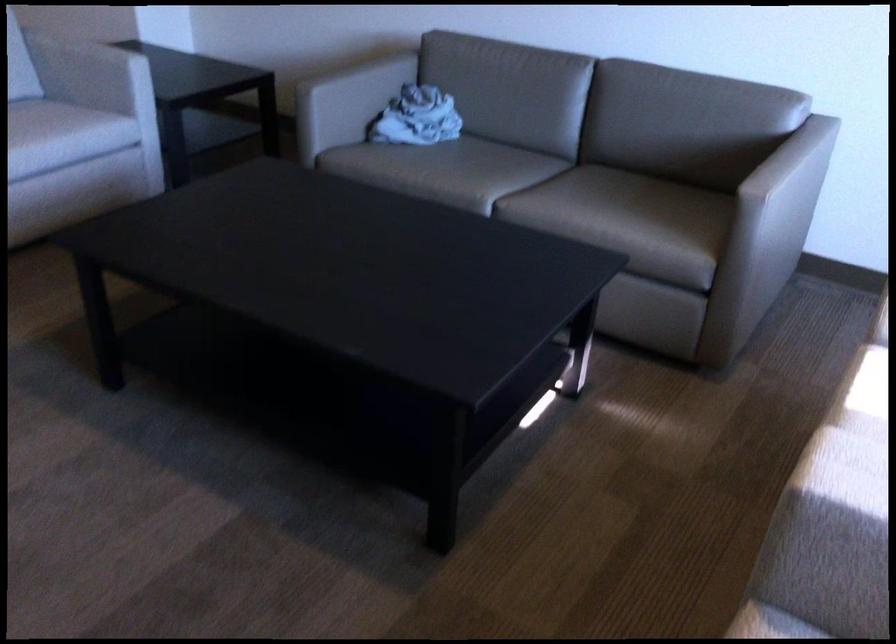
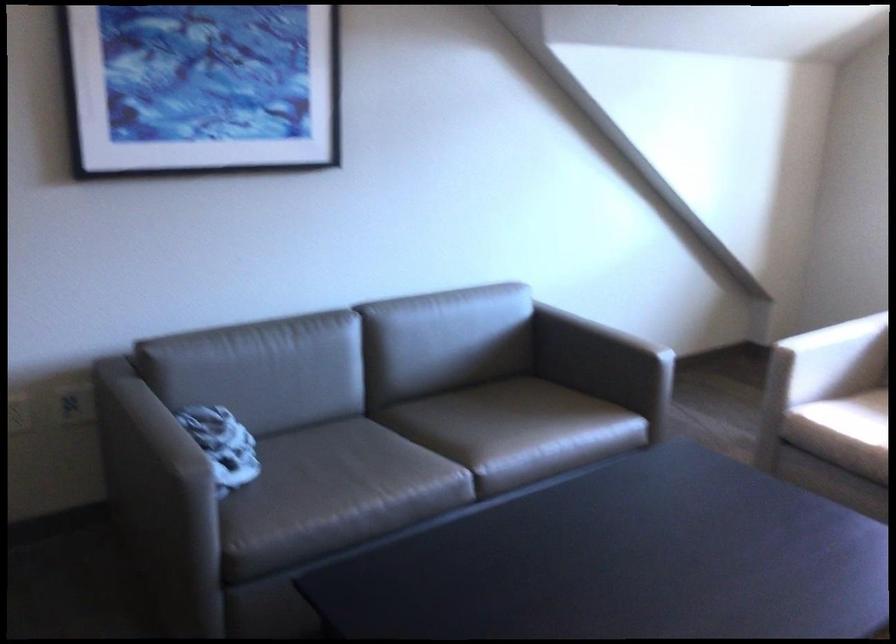
Find the pixel in the second image that matches (x=576, y=200) in the first image.

(497, 430)